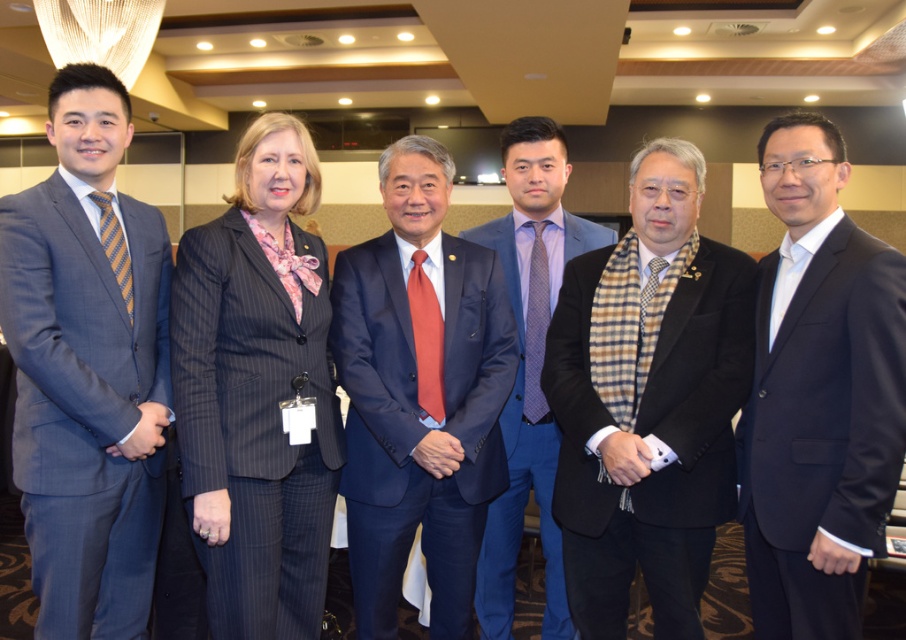
In the professional group photo, where is the navy blue suit at center positioned relative to the striped silk tie at left?

The navy blue suit at center is positioned to the right of the striped silk tie at left.

You are standing in a conference room and see the navy blue wool suit at center. If you were to walk directly towards it from the entrance, which direction should you move? The entrance is located to your left side.

Since the navy blue wool suit at center is located at coordinates approximately 0.667 on the x and 0.907 on the y axis, moving towards it from the entrance on your left would require moving diagonally towards the right and forward.